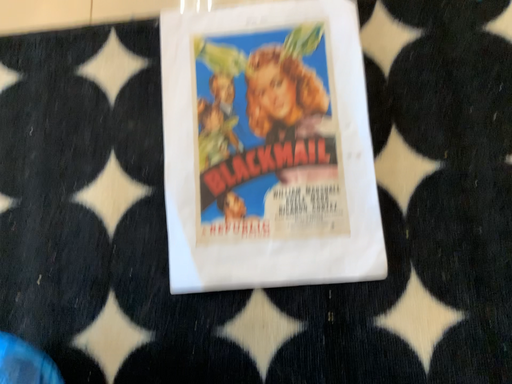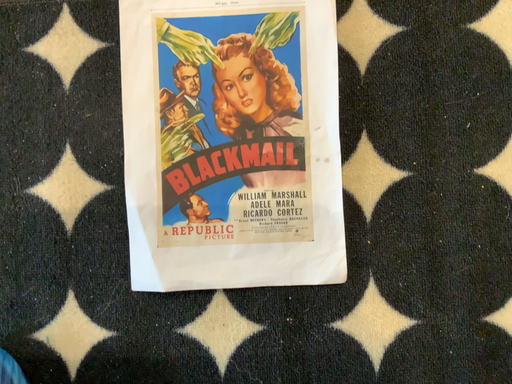
Question: How did the camera likely rotate when shooting the video?

Choices:
 (A) rotated downward
 (B) rotated upward

Answer: (A)